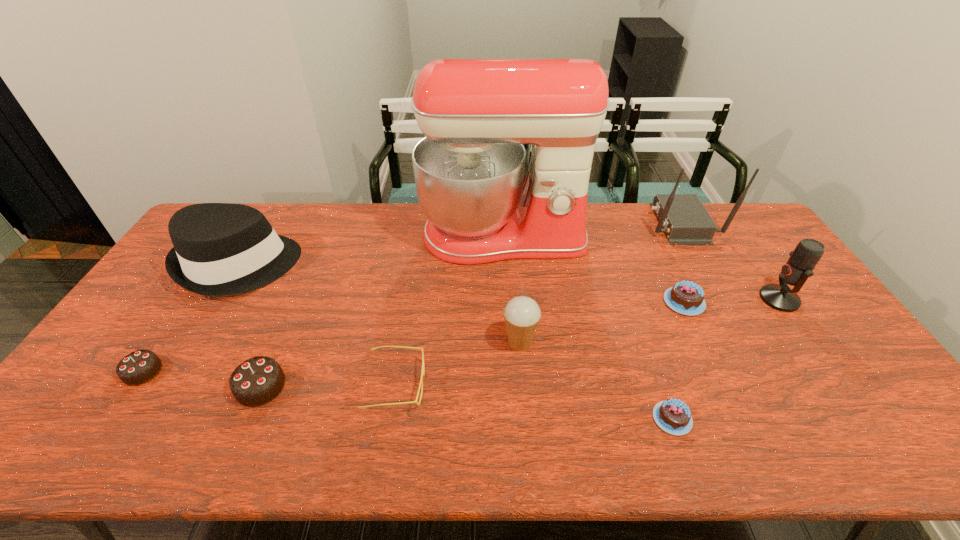
This screenshot has width=960, height=540. What are the coordinates of `mixer` in the screenshot? It's located at (476, 114).

At what (x,y) coordinates should I click in order to perform the action: click on pink mixer. Please return your answer as a coordinate pair (x, y). Looking at the image, I should click on [x=476, y=114].

Where is `router`? The image size is (960, 540). router is located at coordinates (684, 219).

This screenshot has height=540, width=960. I want to click on red microphone, so click(x=808, y=252).

At what (x,y) coordinates should I click in order to perform the action: click on black fedora. Please return your answer as a coordinate pair (x, y). Looking at the image, I should click on (220, 249).

Find the location of a particular element. This screenshot has height=540, width=960. icecream is located at coordinates (522, 314).

Where is `the sixth tallest object`? This screenshot has width=960, height=540. the sixth tallest object is located at coordinates (255, 382).

I want to click on the bigger chocolate chocolate cake, so click(x=255, y=382).

You are a GUI agent. You are given a task and a screenshot of the screen. Output one action in this format:
    pyautogui.click(x=<x>, y=<y>)
    Task: Click on the rightmost chocolate cake
    
    Given the screenshot: What is the action you would take?
    pyautogui.click(x=685, y=297)

Locate an element on the screen. the bigger pink chocolate cake is located at coordinates (685, 297).